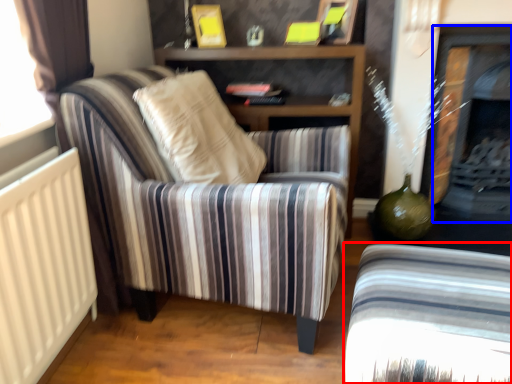
Question: Which object is further to the camera taking this photo, chair (highlighted by a red box) or fireplace (highlighted by a blue box)?

Choices:
 (A) chair
 (B) fireplace

Answer: (B)